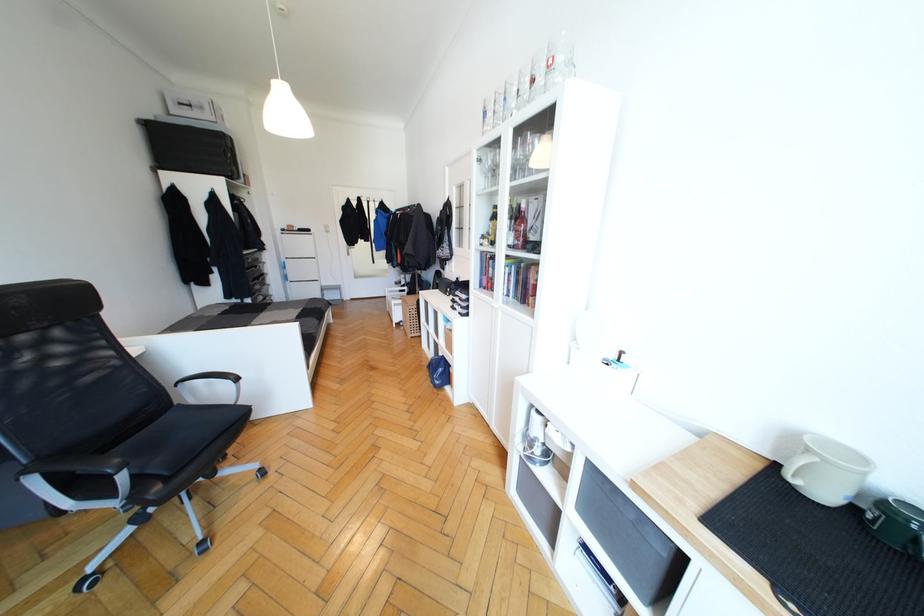
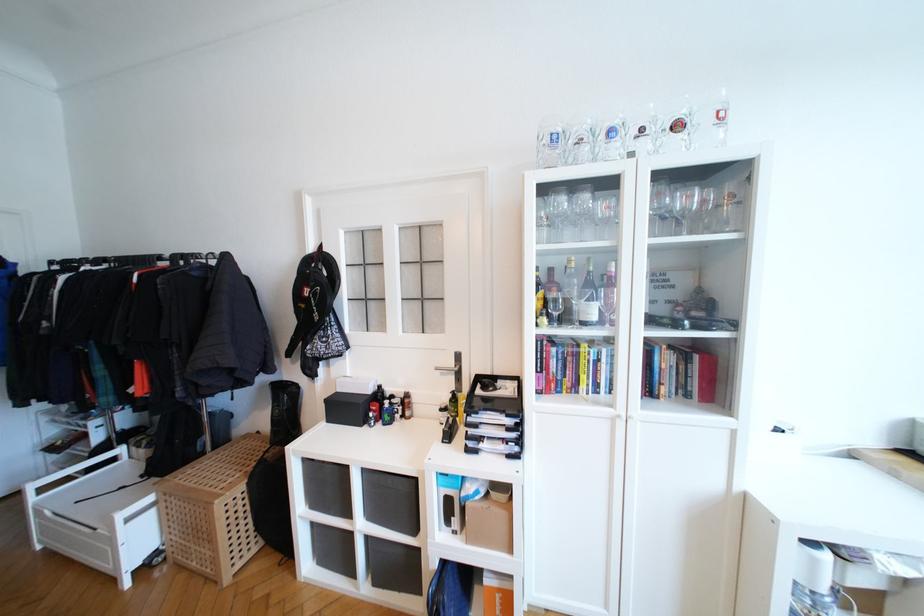
The point at (457, 281) is marked in the first image. Where is the corresponding point in the second image?

(372, 392)